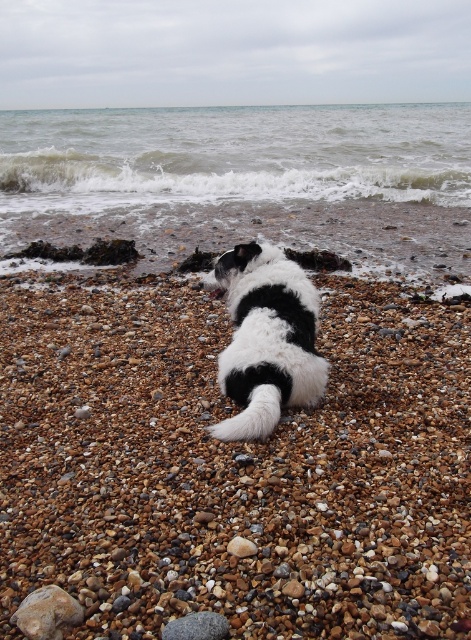
You are a geologist examining the beach scene. You notice the smooth pebble at center and the gray smooth rock at center. Which object is located on top of the other?

The smooth pebble at center is positioned over the gray smooth rock at center.

You are a photographer trying to capture the black and white fur dog at center and the smooth pebble at center in the same frame. Based on their positions, which object is closer to the camera?

The black and white fur dog at center is closer to the camera since the smooth pebble at center has a lesser height compared to it, indicating it is further away.